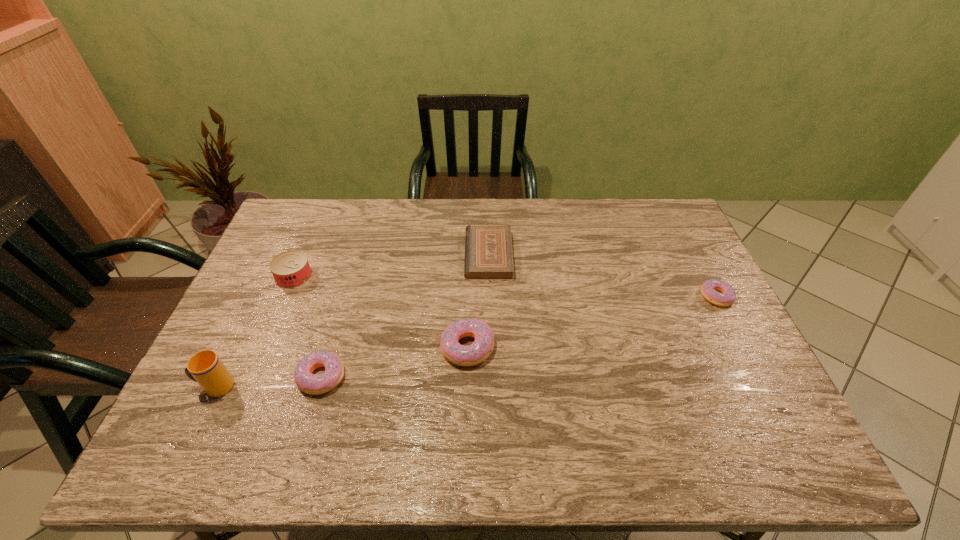
To achieve even spacing by inserting another doughnut among them, please point to a vacant spot for this new doughnut. Please provide its 2D coordinates. Your answer should be formatted as a tuple, i.e. [(x, y)], where the tuple contains the x and y coordinates of a point satisfying the conditions above.

[(598, 320)]